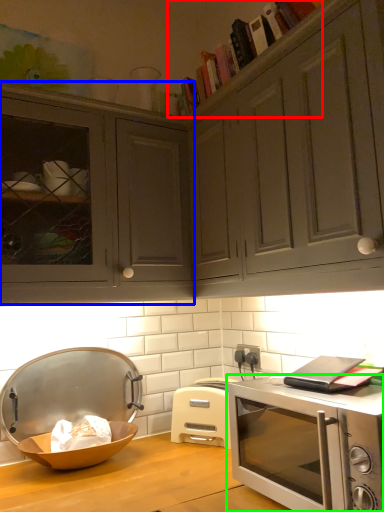
Question: Which object is positioned closest to book (highlighted by a red box)? Select from cabinetry (highlighted by a blue box) and microwave oven (highlighted by a green box).

Choices:
 (A) cabinetry
 (B) microwave oven

Answer: (A)